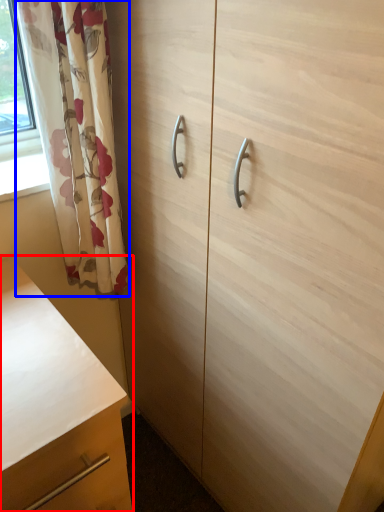
Question: Which object is further to the camera taking this photo, chest of drawers (highlighted by a red box) or curtain (highlighted by a blue box)?

Choices:
 (A) chest of drawers
 (B) curtain

Answer: (B)